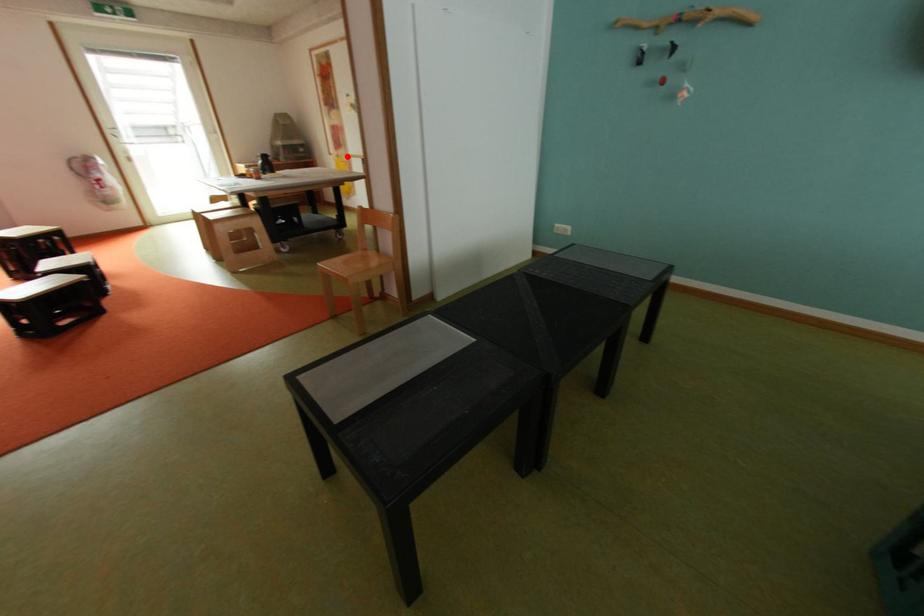
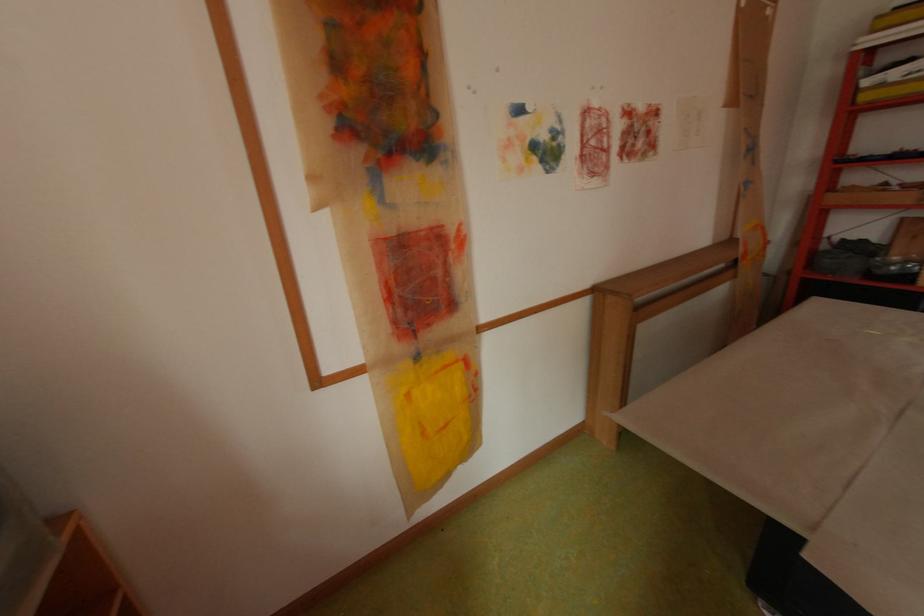
In the second image, find the point that corresponds to the highlighted location in the first image.

(429, 358)